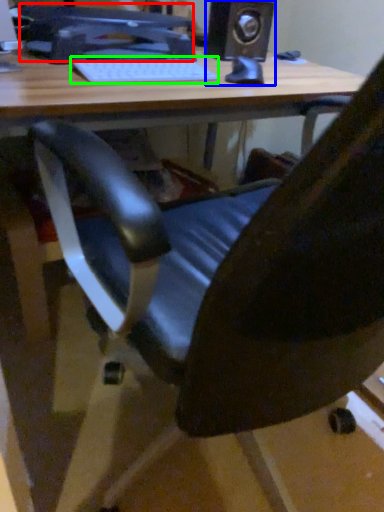
Question: Which object is positioned farthest from computer monitor (highlighted by a red box)? Select from speaker (highlighted by a blue box) and laptop keyboard (highlighted by a green box).

Choices:
 (A) speaker
 (B) laptop keyboard

Answer: (A)